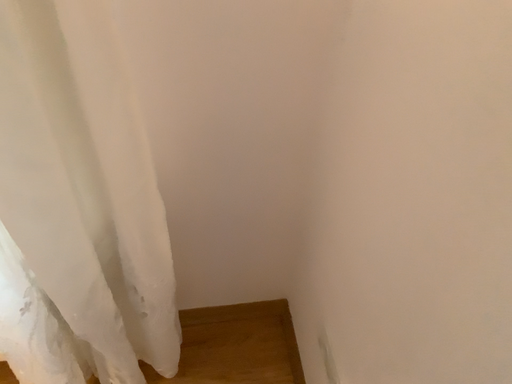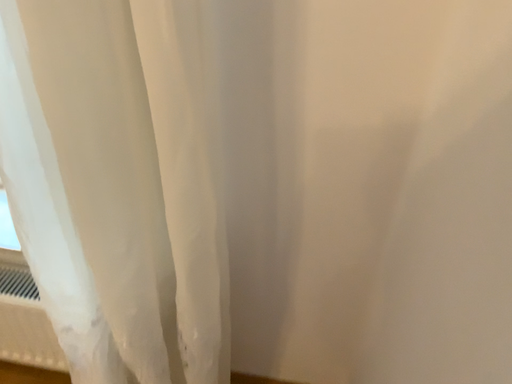
Question: How did the camera likely rotate when shooting the video?

Choices:
 (A) rotated downward
 (B) rotated upward

Answer: (B)